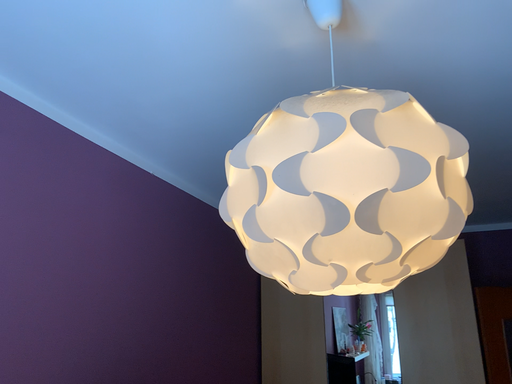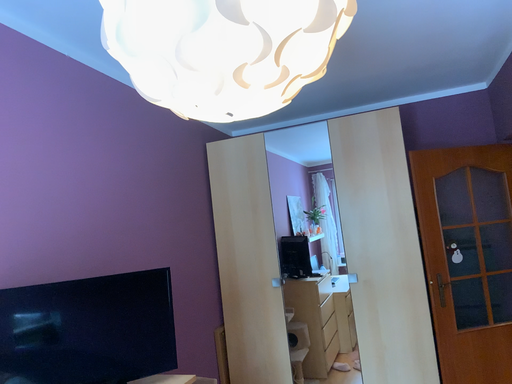
Question: How did the camera likely rotate when shooting the video?

Choices:
 (A) rotated downward
 (B) rotated upward

Answer: (A)